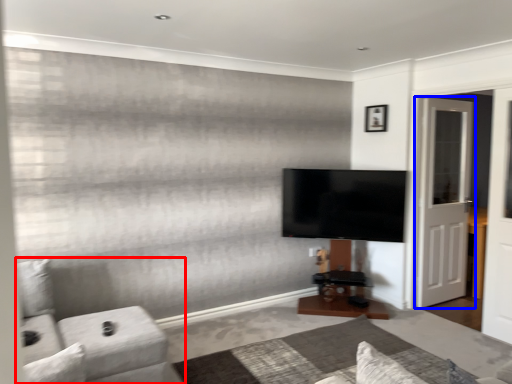
Question: Which object appears closest to the camera in this image, furniture (highlighted by a red box) or door (highlighted by a blue box)?

Choices:
 (A) furniture
 (B) door

Answer: (A)